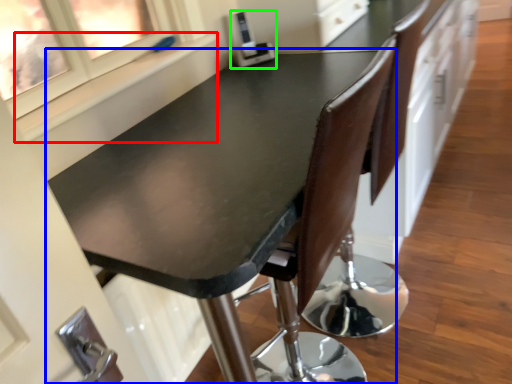
Question: Based on their relative distances, which object is nearer to window sill (highlighted by a red box)? Choose from table (highlighted by a blue box) and appliance (highlighted by a green box).

Choices:
 (A) table
 (B) appliance

Answer: (A)